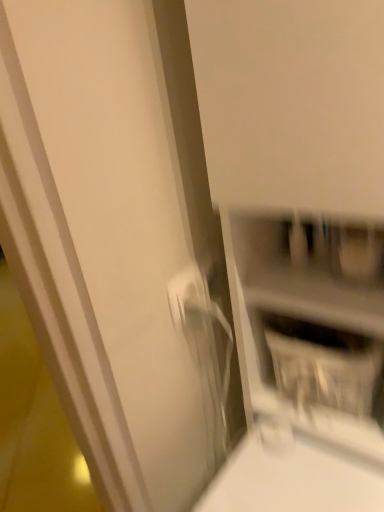
The image size is (384, 512). Identify the location of white glossy shelf at center. (280, 394).

What do you see at coordinates (280, 394) in the screenshot? Image resolution: width=384 pixels, height=512 pixels. I see `white glossy shelf at center` at bounding box center [280, 394].

Measure the distance between point (174, 325) and camera.

A distance of 27.68 inches exists between point (174, 325) and camera.

You are a GUI agent. You are given a task and a screenshot of the screen. Output one action in this format:
    pyautogui.click(x=<x>, y=<y>)
    Task: Click on the white glossy electric outlet at center
    The image size is (384, 512).
    Given the screenshot: What is the action you would take?
    pyautogui.click(x=186, y=293)

What do you see at coordinates (186, 293) in the screenshot? The width and height of the screenshot is (384, 512). I see `white glossy electric outlet at center` at bounding box center [186, 293].

The image size is (384, 512). Find the location of `white glossy shelf at center`. white glossy shelf at center is located at coordinates (280, 394).

Which is more to the left, white glossy electric outlet at center or white glossy shelf at center?

Positioned to the left is white glossy electric outlet at center.

Consider the image. Is white glossy electric outlet at center in front of white glossy shelf at center?

No, it is behind white glossy shelf at center.

Which is nearer, (201, 293) or (381, 442)?

Clearly, point (201, 293) is more distant from the camera than point (381, 442).

Looking at this image, from the image's perspective, between white glossy electric outlet at center and white glossy shelf at center, who is located below?

white glossy shelf at center, from the image's perspective.

From a real-world perspective, is white glossy electric outlet at center above or below white glossy shelf at center?

Clearly, from a real-world perspective, white glossy electric outlet at center is above white glossy shelf at center.

Is white glossy electric outlet at center thinner than white glossy shelf at center?

Result: Yes, white glossy electric outlet at center is thinner than white glossy shelf at center.

Is white glossy electric outlet at center taller or shorter than white glossy shelf at center?

Considering their sizes, white glossy electric outlet at center has less height than white glossy shelf at center.

Looking at this image, between white glossy electric outlet at center and white glossy shelf at center, which one has larger size?

white glossy shelf at center is bigger.

Would you say white glossy shelf at center is part of white glossy electric outlet at center's contents?

Actually, white glossy shelf at center is outside white glossy electric outlet at center.

Is white glossy electric outlet at center far away from white glossy shelf at center?

No, white glossy electric outlet at center is not far away from white glossy shelf at center.

Is white glossy electric outlet at center oriented towards white glossy shelf at center?

No, white glossy electric outlet at center is not facing towards white glossy shelf at center.

What's the angular difference between white glossy electric outlet at center and white glossy shelf at center's facing directions?

81.1 degrees separate the facing orientations of white glossy electric outlet at center and white glossy shelf at center.

Where is `electric outlet on the left of white glossy shelf at center`? electric outlet on the left of white glossy shelf at center is located at coordinates (186, 293).

Looking at this image, based on their positions, is white glossy shelf at center located to the left or right of white glossy electric outlet at center?

white glossy shelf at center is positioned on white glossy electric outlet at center's right side.

Between white glossy shelf at center and white glossy electric outlet at center, which one is positioned in front?

white glossy shelf at center.

Which is less distant, (x=368, y=459) or (x=171, y=288)?

Point (x=368, y=459) is closer to the camera than point (x=171, y=288).

From the image's perspective, does white glossy shelf at center appear lower than white glossy electric outlet at center?

Yes, from the image's perspective, white glossy shelf at center is below white glossy electric outlet at center.

From a real-world perspective, is white glossy shelf at center beneath white glossy electric outlet at center?

Yes, from a real-world perspective, white glossy shelf at center is under white glossy electric outlet at center.

Can you confirm if white glossy shelf at center is wider than white glossy electric outlet at center?

Indeed, white glossy shelf at center has a greater width compared to white glossy electric outlet at center.

In terms of height, does white glossy shelf at center look taller or shorter compared to white glossy electric outlet at center?

white glossy shelf at center is taller than white glossy electric outlet at center.

Considering the sizes of objects white glossy shelf at center and white glossy electric outlet at center in the image provided, who is smaller, white glossy shelf at center or white glossy electric outlet at center?

Smaller between the two is white glossy electric outlet at center.

Is white glossy shelf at center spatially inside white glossy electric outlet at center, or outside of it?

white glossy shelf at center is outside white glossy electric outlet at center.

Is there a large distance between white glossy shelf at center and white glossy electric outlet at center?

No, white glossy shelf at center is not far away from white glossy electric outlet at center.

Is white glossy shelf at center facing away from white glossy electric outlet at center?

No.

Locate an element on the screen. Image resolution: width=384 pixels, height=512 pixels. electric outlet above the white glossy shelf at center (from the image's perspective) is located at coordinates (186, 293).

Locate an element on the screen. This screenshot has height=512, width=384. shelf lying on the right of white glossy electric outlet at center is located at coordinates (280, 394).

This screenshot has height=512, width=384. What are the coordinates of `electric outlet above the white glossy shelf at center (from the image's perspective)` in the screenshot? It's located at (186, 293).